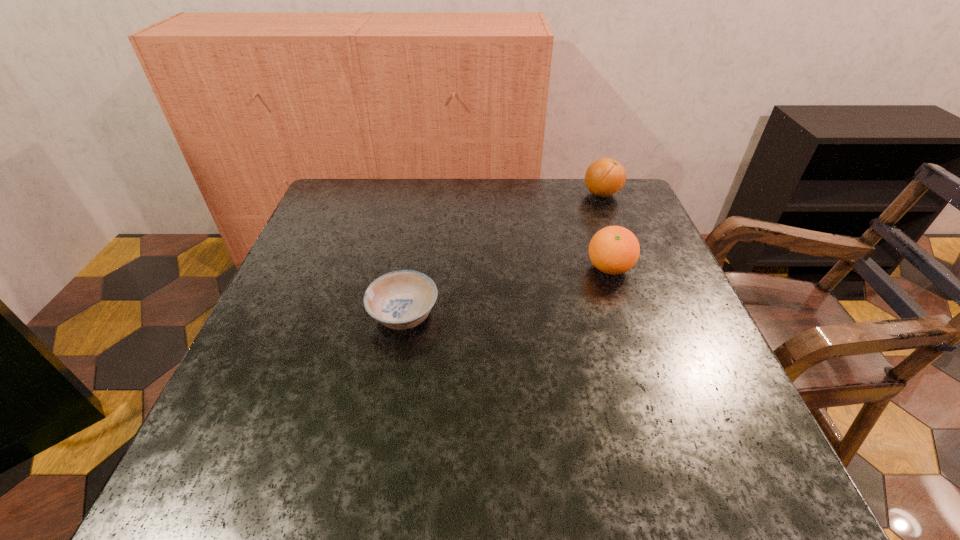
In order to click on the farther orange in this screenshot , I will do `click(605, 177)`.

Image resolution: width=960 pixels, height=540 pixels. I want to click on the second nearest object, so click(613, 250).

The image size is (960, 540). I want to click on bowl, so click(402, 299).

Identify the location of the shortest object. Image resolution: width=960 pixels, height=540 pixels. (402, 299).

At what (x,y) coordinates should I click in order to perform the action: click on blank space located on the front of the farther orange. Please return your answer as a coordinate pair (x, y). The height and width of the screenshot is (540, 960). Looking at the image, I should click on (637, 287).

Where is `free space located 0.340m on the front of the nearer orange`? free space located 0.340m on the front of the nearer orange is located at coordinates (663, 431).

Where is `vacant space positioned on the back of the nearest object`? vacant space positioned on the back of the nearest object is located at coordinates (422, 211).

Identify the location of object that is at the far edge. (605, 177).

You are a GUI agent. You are given a task and a screenshot of the screen. Output one action in this format:
    pyautogui.click(x=<x>, y=<y>)
    Task: Click on the object situated at the far right corner
    This screenshot has width=960, height=540.
    Given the screenshot: What is the action you would take?
    pyautogui.click(x=605, y=177)

At what (x,y) coordinates should I click in order to perform the action: click on blank space at the far edge. Please return your answer as a coordinate pair (x, y). Looking at the image, I should click on (479, 190).